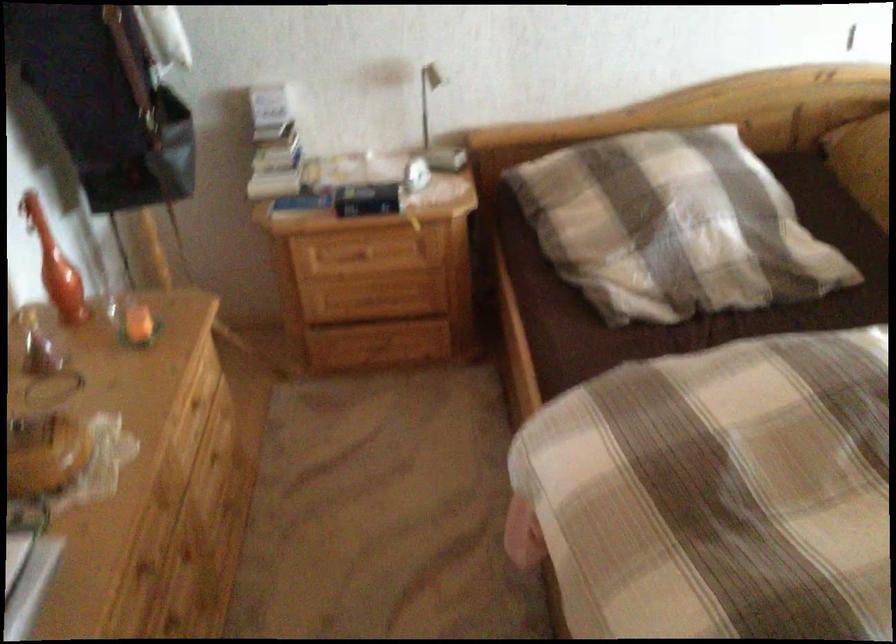
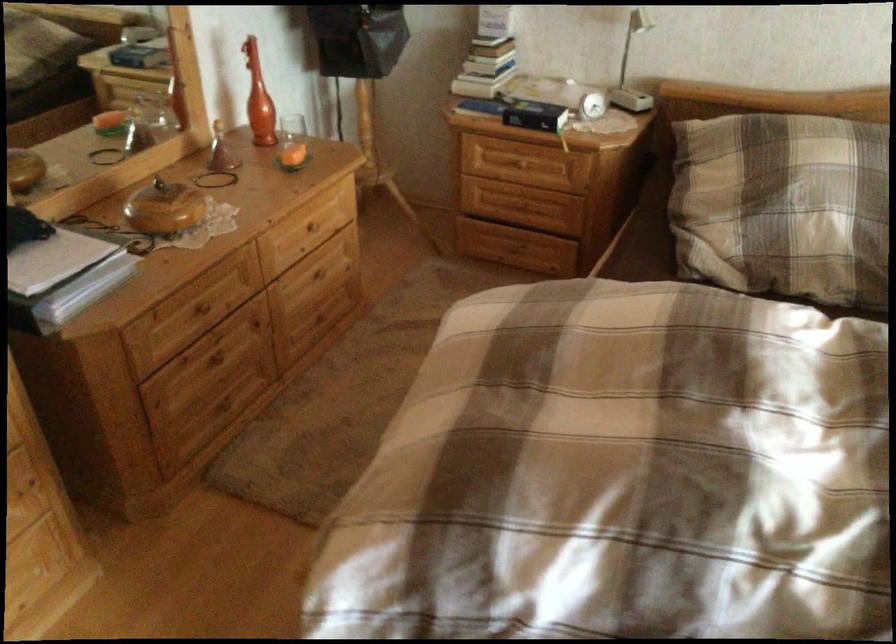
In the second image, find the point that corresponds to the point at 197,406 in the first image.

(308, 225)